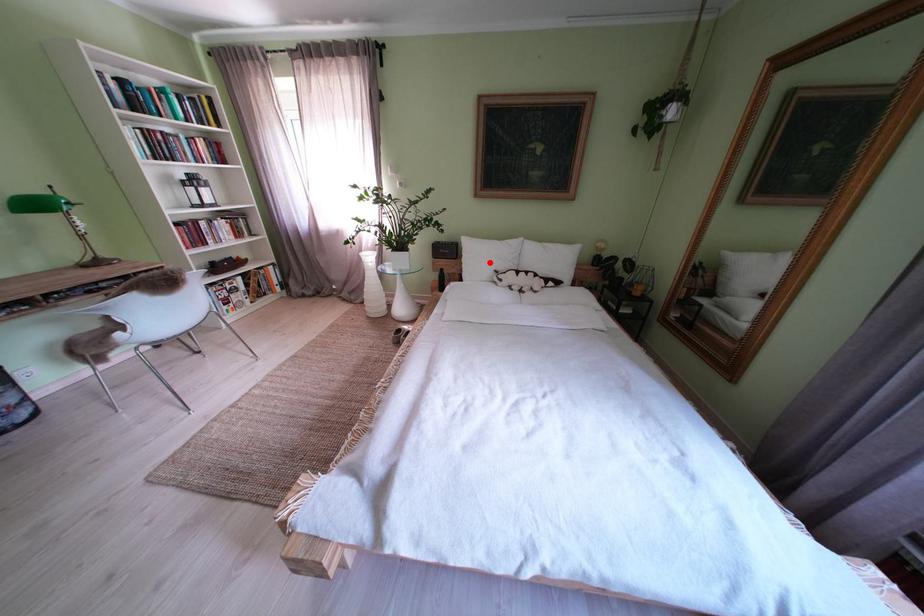
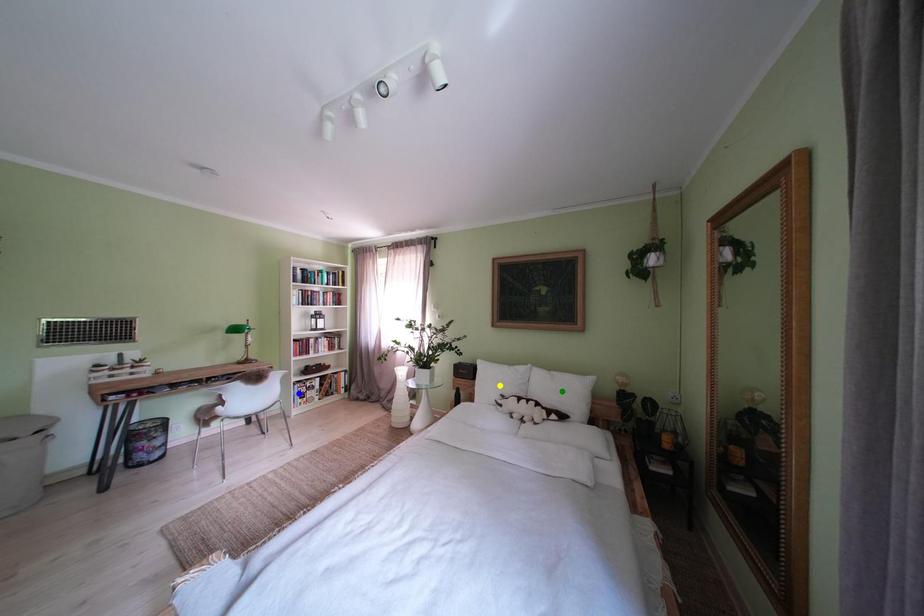
Question: I am providing you with two images of the same scene from different viewpoints. A red point is marked on the first image. You are given multiple points on the second image. Which mark in image 2 goes with the point in image 1?

Choices:
 (A) blue point
 (B) yellow point
 (C) green point

Answer: (B)